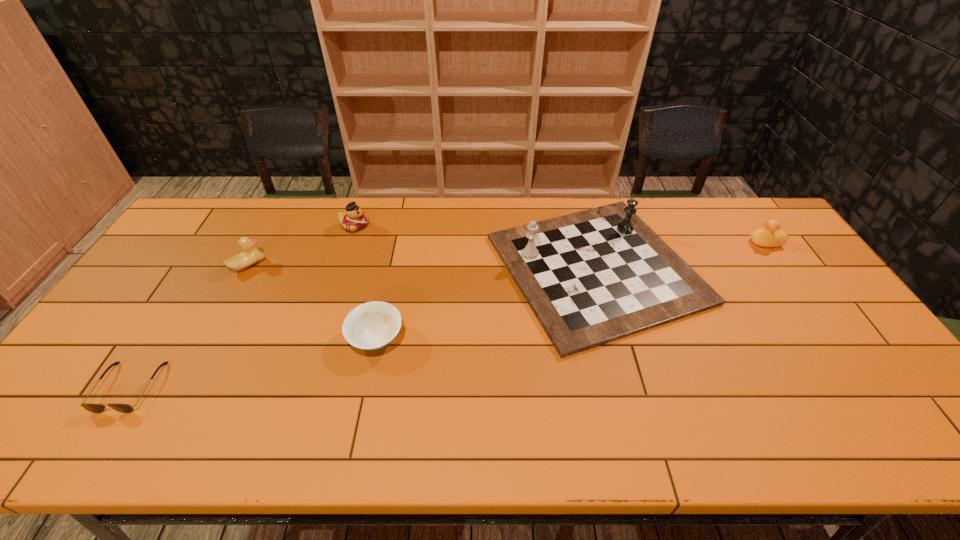
You are a GUI agent. You are given a task and a screenshot of the screen. Output one action in this format:
    pyautogui.click(x=<x>, y=<y>)
    Task: Click on the vacant region between the leftmost duck and the bowl
    This screenshot has height=540, width=960.
    Given the screenshot: What is the action you would take?
    pyautogui.click(x=312, y=301)

Find the location of a particular element. Image resolution: width=960 pixels, height=540 pixels. vacant point located between the nearest duck and the farthest duck is located at coordinates (301, 246).

Locate an element on the screen. This screenshot has height=540, width=960. vacant space that is in between the fifth tallest object and the second object from right to left is located at coordinates (486, 303).

This screenshot has height=540, width=960. Find the location of `vacant area that lies between the tallest object and the bowl`. vacant area that lies between the tallest object and the bowl is located at coordinates (486, 303).

The height and width of the screenshot is (540, 960). Find the location of `vacant area between the sunglasses and the fifth tallest object`. vacant area between the sunglasses and the fifth tallest object is located at coordinates (252, 362).

Identify which object is located as the fourth nearest to the second shortest object. Please provide its 2D coordinates. Your answer should be formatted as a tuple, i.e. [(x, y)], where the tuple contains the x and y coordinates of a point satisfying the conditions above.

[(92, 407)]

Point out which object is positioned as the fourth nearest to the rightmost duck. Please provide its 2D coordinates. Your answer should be formatted as a tuple, i.e. [(x, y)], where the tuple contains the x and y coordinates of a point satisfying the conditions above.

[(250, 255)]

This screenshot has height=540, width=960. I want to click on duck that is the second nearest to the leftmost duck, so click(765, 237).

Choose which duck is the second nearest neighbor to the farthest duck. Please provide its 2D coordinates. Your answer should be formatted as a tuple, i.e. [(x, y)], where the tuple contains the x and y coordinates of a point satisfying the conditions above.

[(765, 237)]

Locate an element on the screen. The image size is (960, 540). vacant space that satisfies the following two spatial constraints: 1. on the face of the farthest duck; 2. on the right side of the second shortest object is located at coordinates (318, 338).